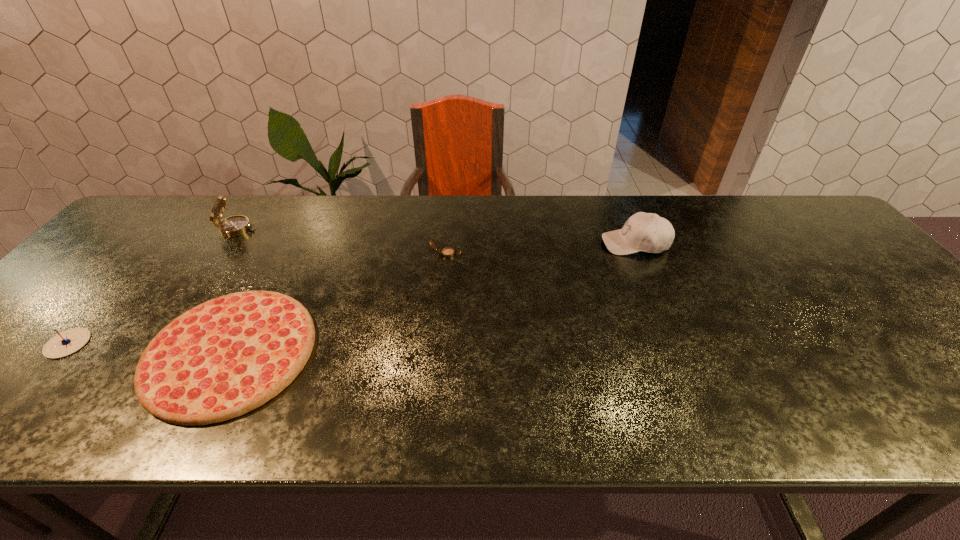
Locate which object ranks fourth in proximity to the rightmost object. Please provide its 2D coordinates. Your answer should be formatted as a tuple, i.e. [(x, y)], where the tuple contains the x and y coordinates of a point satisfying the conditions above.

[(67, 342)]

You are a GUI agent. You are given a task and a screenshot of the screen. Output one action in this format:
    pyautogui.click(x=<x>, y=<y>)
    Task: Click on the object that ranks as the fourth closest to the baseball cap
    
    Given the screenshot: What is the action you would take?
    pyautogui.click(x=67, y=342)

The height and width of the screenshot is (540, 960). I want to click on compass that is the third closest to the shortest object, so click(x=447, y=252).

Identify which compass is the second closest to the farthest compass. Please provide its 2D coordinates. Your answer should be formatted as a tuple, i.e. [(x, y)], where the tuple contains the x and y coordinates of a point satisfying the conditions above.

[(447, 252)]

The height and width of the screenshot is (540, 960). What are the coordinates of `free location that satisfies the following two spatial constraints: 1. on the front-facing side of the rightmost object; 2. on the front side of the nearest compass` in the screenshot? It's located at (678, 343).

At what (x,y) coordinates should I click in order to perform the action: click on vacant space that satisfies the following two spatial constraints: 1. on the back side of the shortest object; 2. with the dial facing the tallest compass. Please return your answer as a coordinate pair (x, y). Image resolution: width=960 pixels, height=540 pixels. Looking at the image, I should click on (296, 229).

This screenshot has height=540, width=960. I want to click on vacant space that satisfies the following two spatial constraints: 1. with the dial facing the pizza; 2. on the left side of the second compass from left to right, so click(x=153, y=352).

Where is `free location that satisfies the following two spatial constraints: 1. on the back side of the shortest object; 2. with the dial facing the tallest compass`? This screenshot has width=960, height=540. free location that satisfies the following two spatial constraints: 1. on the back side of the shortest object; 2. with the dial facing the tallest compass is located at coordinates (296, 229).